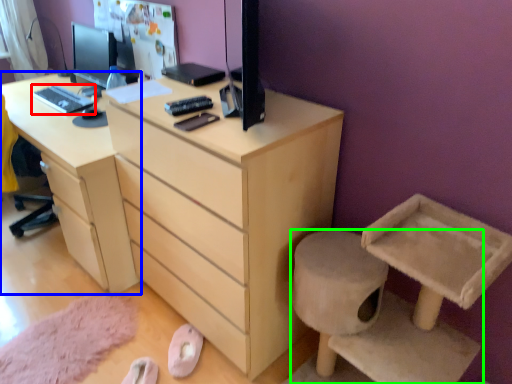
Question: Which object is the closest to the desktop (highlighted by a red box)? Choose among these: desk (highlighted by a blue box) or furniture (highlighted by a green box).

Choices:
 (A) desk
 (B) furniture

Answer: (A)